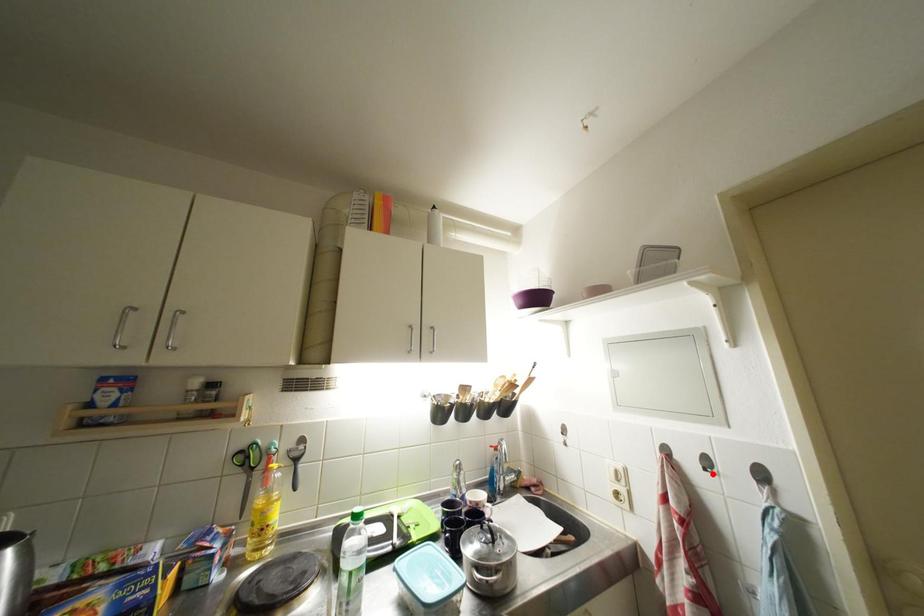
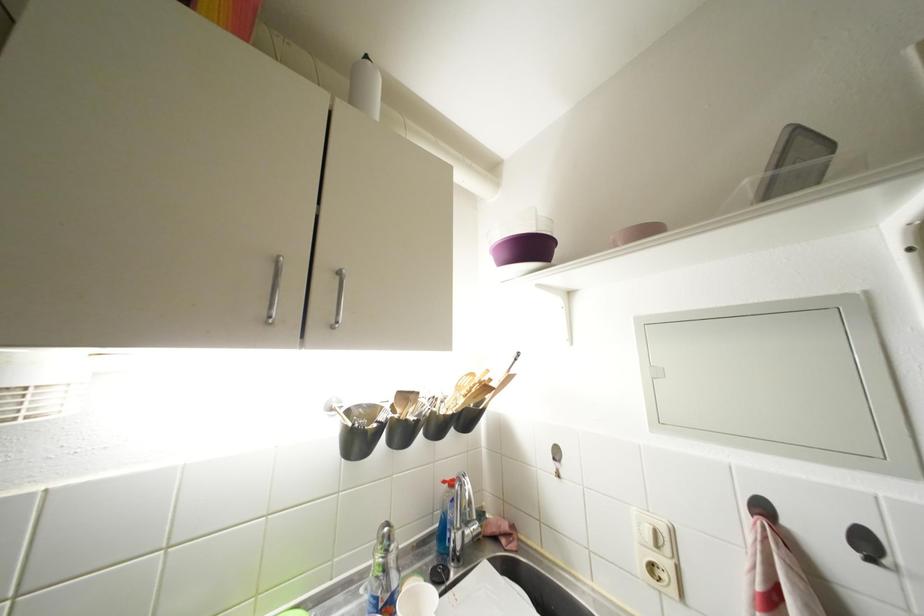
Question: A red point is marked in image1. In image2, is the corresponding 3D point closer to the camera or farther? Reply with the corresponding letter.

Choices:
 (A) The corresponding 3D point is closer.
 (B) The corresponding 3D point is farther.

Answer: (A)